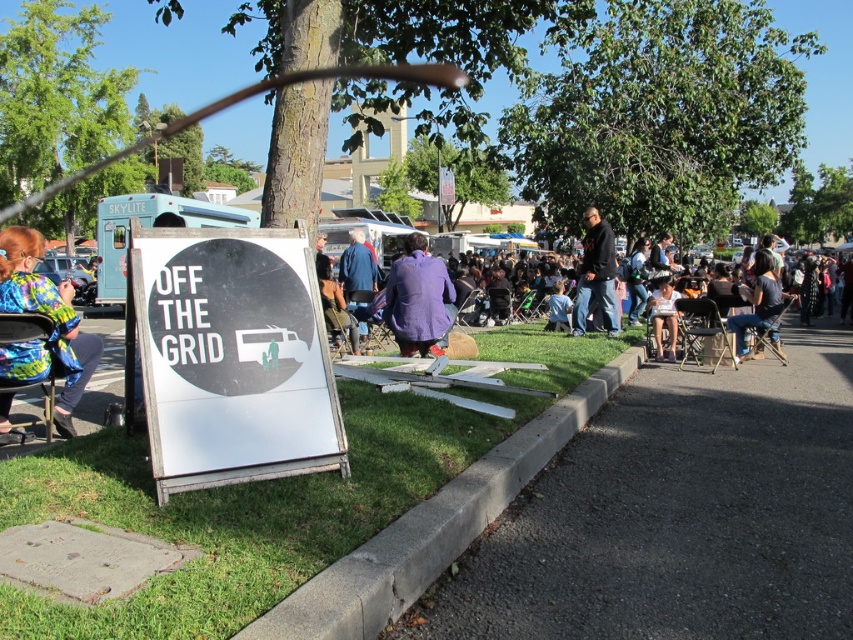
You are a photographer at the event and want to capture both the purple wool coat at center and the white cotton shirt at center in a single photo. Which one should you focus on first to ensure both are in frame?

The purple wool coat at center is above the white cotton shirt at center, so focusing on the purple wool coat at center first will help ensure both are within the frame.

You are attending an outdoor event in the park and see the white wood sign at lower left and the purple wool coat at center. Which object is positioned lower in the scene?

The white wood sign at lower left is positioned lower than the purple wool coat at center.

You are organizing a small event and need to ensure attendees can comfortably move between the purple wool coat at center and the white cotton shirt at center. What is the minimum width of a walkway required between them to allow two people to pass each other without touching?

The purple wool coat at center and white cotton shirt at center are 4.00 meters apart. To allow two people to pass comfortably, a walkway width of at least 1.2 meters is recommended, which is well within the distance provided.